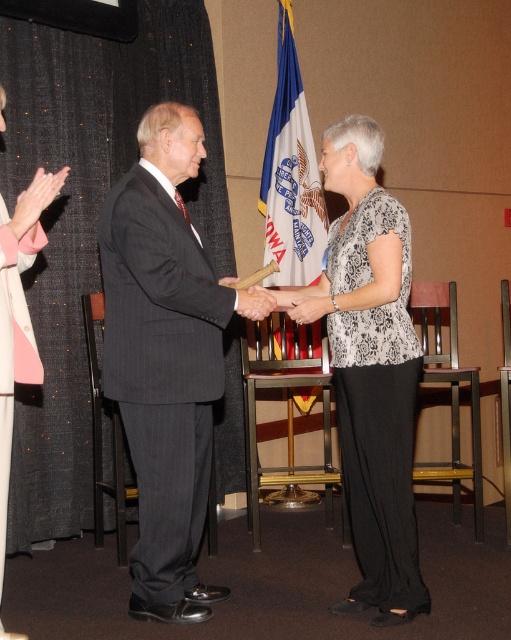
You are an event photographer at the formal event. You need to capture a photo where both the white fabric flag at center and the smooth wood hand at center are visible. Based on their positions, which object should you ensure is in the foreground to avoid it being blocked?

The smooth wood hand at center should be in the foreground to avoid blocking the white fabric flag at center since it is below the flag.

You are at the event and want to locate the black printed blouse at center. What are the coordinates where you can find it?

The black printed blouse at center can be found at coordinates point (373,371).